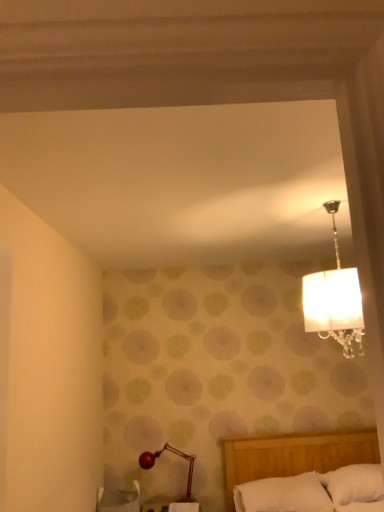
Question: From the image's perspective, is shiny red lamp at lower left positioned above or below white woven basket at lower left?

Choices:
 (A) above
 (B) below

Answer: (A)

Question: From a real-world perspective, relative to white woven basket at lower left, is shiny red lamp at lower left vertically above or below?

Choices:
 (A) below
 (B) above

Answer: (B)

Question: Considering the real-world distances, which object is closest to the shiny red lamp at lower left?

Choices:
 (A) white soft pillow at lower center, the 1th pillow viewed from the left
 (B) white soft pillow at lower right, marked as the second pillow in a left-to-right arrangement
 (C) white woven basket at lower left

Answer: (C)

Question: Considering the real-world distances, which object is farthest from the white soft pillow at lower right, arranged as the 1th pillow when viewed from the right?

Choices:
 (A) shiny red lamp at lower left
 (B) white woven basket at lower left
 (C) white soft pillow at lower center, the 1th pillow viewed from the left

Answer: (B)